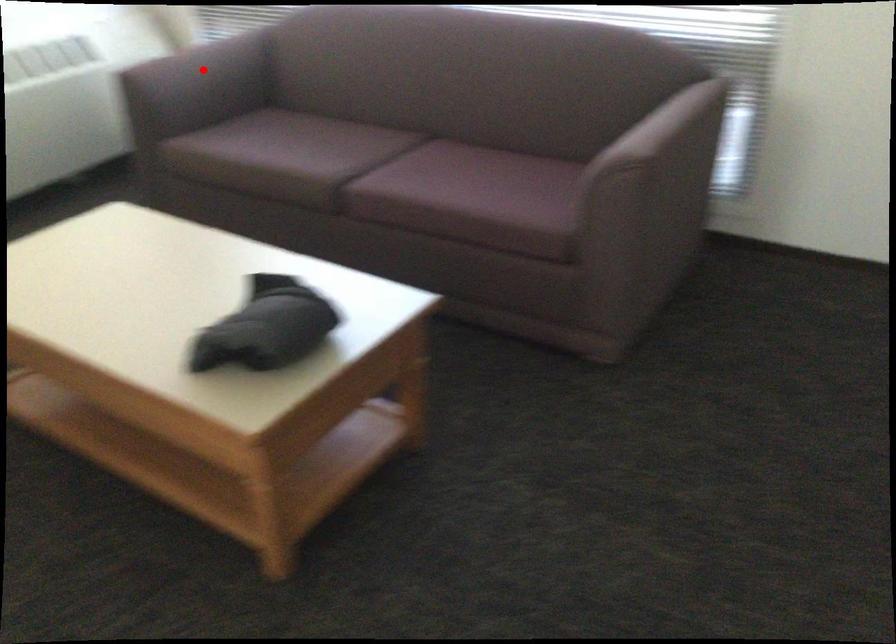
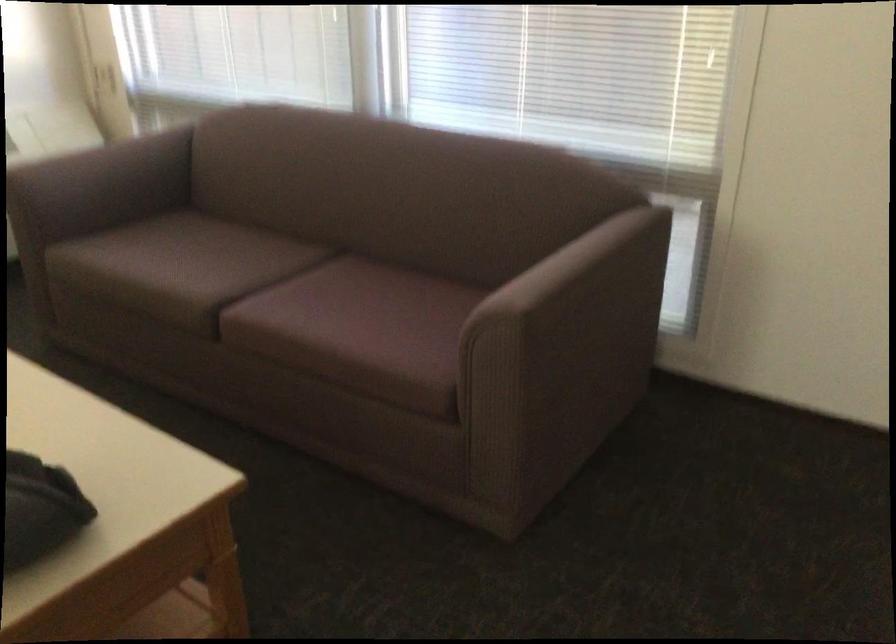
In the second image, find the point that corresponds to the highlighted location in the first image.

(113, 173)